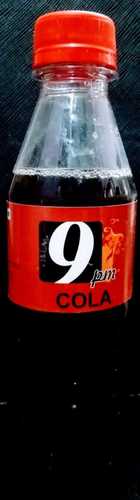
Locate an element on the screen. The image size is (140, 500). bottle is located at coordinates (73, 131).